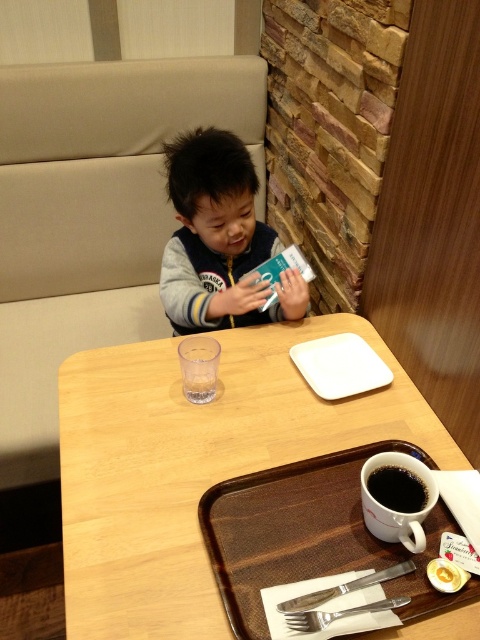
Question: Which object appears closest to the camera in this image?

Choices:
 (A) matte gray jacket at center
 (B) smooth yellow egg at lower right
 (C) brown textured tray at lower center

Answer: (C)

Question: Which of the following is the closest to the observer?

Choices:
 (A) smooth yellow egg at lower right
 (B) black matte cup at lower right
 (C) wooden tray at center

Answer: (C)

Question: Does matte gray jacket at center have a lesser width compared to smooth yellow egg at lower right?

Choices:
 (A) yes
 (B) no

Answer: (B)

Question: Is matte gray jacket at center smaller than smooth yellow egg at lower right?

Choices:
 (A) yes
 (B) no

Answer: (B)

Question: Can you confirm if wooden tray at center is positioned below smooth yellow egg at lower right?

Choices:
 (A) yes
 (B) no

Answer: (B)

Question: Which point is farther to the camera?

Choices:
 (A) matte gray jacket at center
 (B) black matte cup at lower right

Answer: (A)